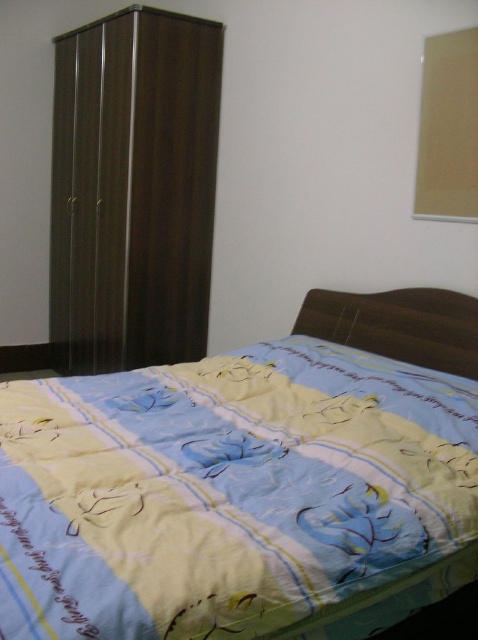
Between dark wood wardrobe at left and yellow printed fabric bed at lower left, which one has more height?

dark wood wardrobe at left is taller.

Does dark wood wardrobe at left appear over yellow printed fabric bed at lower left?

Yes.

Which is in front, point (205, 320) or point (416, 614)?

Point (416, 614) is in front.

In order to click on dark wood wardrobe at left in this screenshot , I will do `click(132, 189)`.